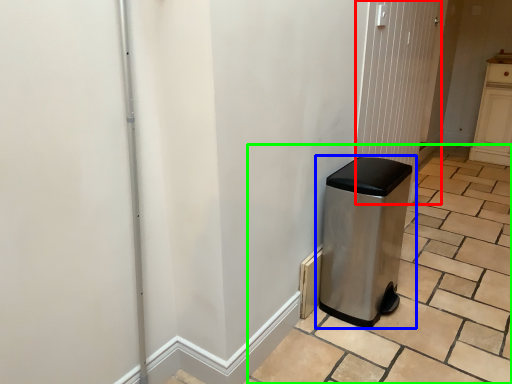
Question: Estimate the real-world distances between objects in this image. Which object is closer to screen door (highlighted by a red box), waste container (highlighted by a blue box) or tile (highlighted by a green box)?

Choices:
 (A) waste container
 (B) tile

Answer: (A)